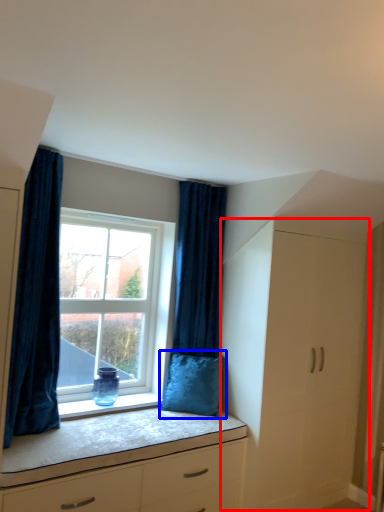
Question: Which object appears closest to the camera in this image, file cabinet (highlighted by a red box) or pillow (highlighted by a blue box)?

Choices:
 (A) file cabinet
 (B) pillow

Answer: (A)